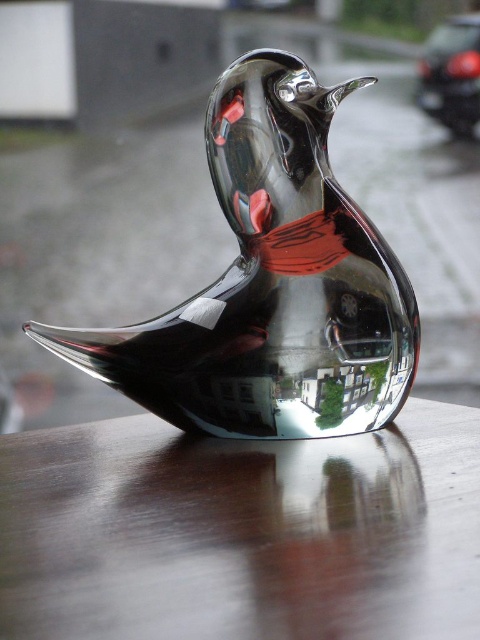
You are an interior designer planning to place a new sculpture on the glossy wood table at center. The sculpture requires a minimum of 1 meter of space in all directions. Given the table is 1.2 meters wide, can the sculpture be placed safely without overhanging?

The glossy wood table at center has a width of 1.2 meters. Since the sculpture requires a minimum of 1 meter of space in all directions, placing it centrally would leave 0.1 meters on each side, which is insufficient. Therefore, the sculpture cannot be placed safely without overhanging.

You are standing in front of the reflective metallic bird sculpture. There is a point marked at coordinates (x=241, y=532). Where is this point located relative to the sculpture?

The point (x=241, y=532) is on the glossy wood table at center, which is where the sculpture is resting.

You are an art curator planning to install a spotlight on the glossy wood table at center. The spotlight is placed directly above the table. Will the shiny metallic bird at center cast a shadow on the table?

The glossy wood table at center is located below the shiny metallic bird at center, so when the spotlight is placed directly above the table, the bird will cast a shadow on the table.